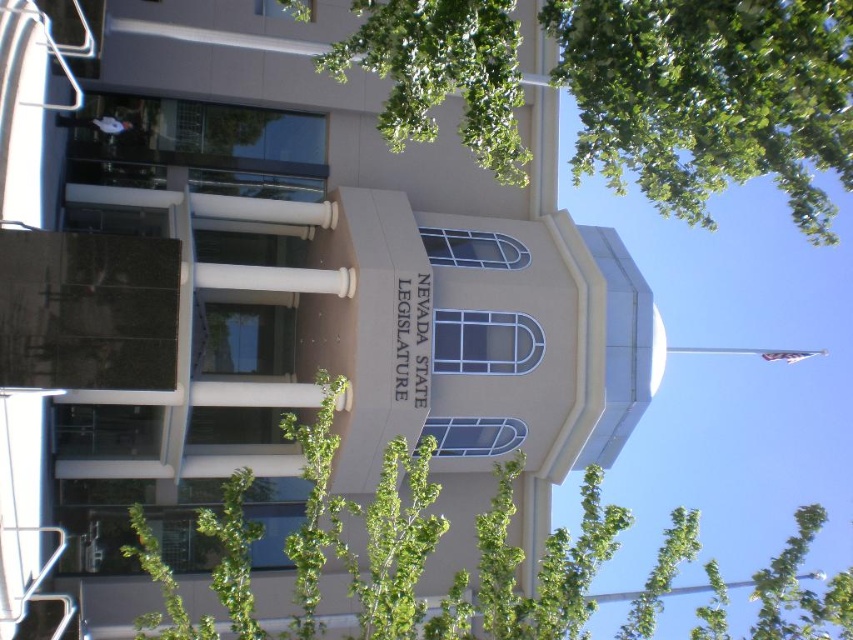
Question: Is green leafy tree at upper center wider than green leafy tree at lower left?

Choices:
 (A) no
 (B) yes

Answer: (A)

Question: Is green leafy tree at upper center to the left of green leafy tree at lower left from the viewer's perspective?

Choices:
 (A) no
 (B) yes

Answer: (B)

Question: Which point is farther to the camera?

Choices:
 (A) green leafy tree at upper center
 (B) green leafy tree at lower left

Answer: (B)

Question: Which point appears closest to the camera in this image?

Choices:
 (A) (672, 518)
 (B) (602, 152)

Answer: (B)

Question: Considering the relative positions of green leafy tree at upper center and green leafy tree at lower left in the image provided, where is green leafy tree at upper center located with respect to green leafy tree at lower left?

Choices:
 (A) right
 (B) left

Answer: (B)